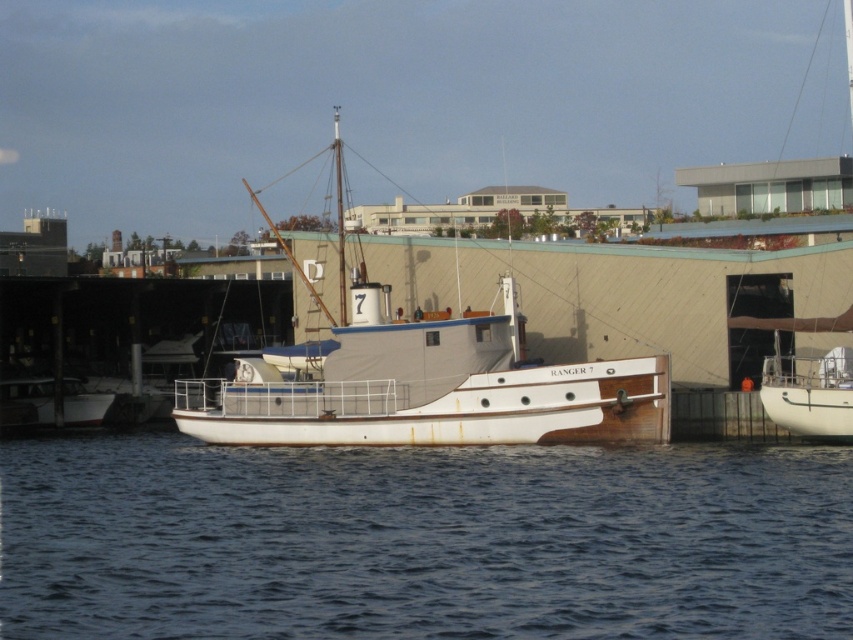
What do you see at coordinates (426, 385) in the screenshot? The height and width of the screenshot is (640, 853). I see `white wood boat at center` at bounding box center [426, 385].

Who is more forward, (488, 387) or (827, 380)?

Point (827, 380) is in front.

Is point (448, 384) positioned after point (820, 412)?

Yes, it is behind point (820, 412).

Identify the location of white wood boat at center. (426, 385).

In the scene shown: Who is shorter, white matte sailboat at right or rusty metal boat at lower left?

rusty metal boat at lower left is shorter.

Does white matte sailboat at right have a larger size compared to rusty metal boat at lower left?

Indeed, white matte sailboat at right has a larger size compared to rusty metal boat at lower left.

The width and height of the screenshot is (853, 640). What do you see at coordinates (809, 394) in the screenshot?
I see `white matte sailboat at right` at bounding box center [809, 394].

Identify the location of white matte sailboat at right. The width and height of the screenshot is (853, 640). (809, 394).

Does blue water at center have a lesser height compared to rusty metal boat at lower left?

Yes.

Which of these two, blue water at center or rusty metal boat at lower left, stands taller?

With more height is rusty metal boat at lower left.

Find the location of a particular element. Image resolution: width=853 pixels, height=640 pixels. blue water at center is located at coordinates (422, 540).